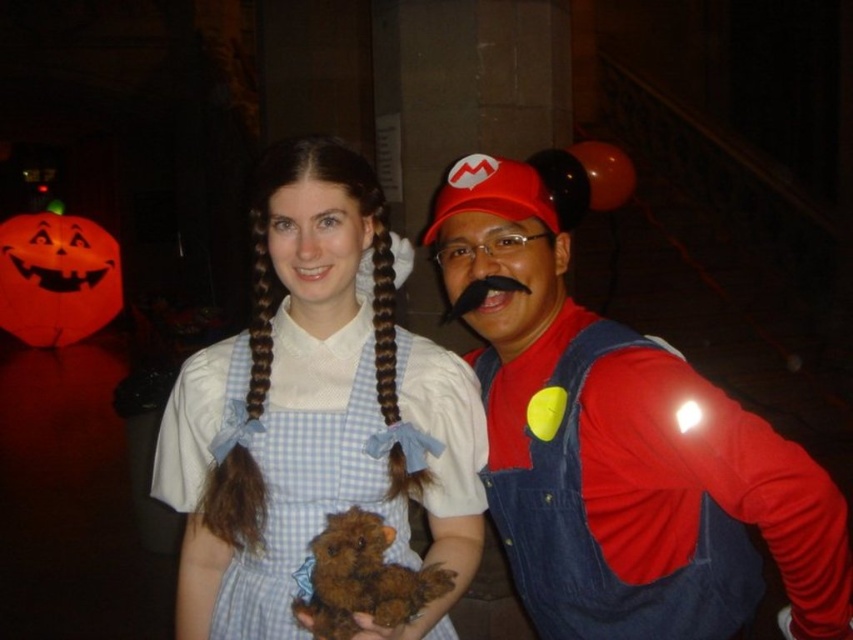
Does point (363, 346) come behind point (392, 380)?

That is True.

Find the location of a particular element. blue checkered dress at center is located at coordinates (315, 413).

In order to click on blue checkered dress at center in this screenshot , I will do `click(315, 413)`.

Is point (717, 445) closer to viewer compared to point (392, 372)?

Yes, point (717, 445) is closer to viewer.

Which is behind, point (643, 420) or point (250, 349)?

The point (250, 349) is more distant.

The width and height of the screenshot is (853, 640). Identify the location of red denim overalls at right. (621, 448).

Between red denim overalls at right and blue checkered dress at center, which one appears on the right side from the viewer's perspective?

red denim overalls at right

Is red denim overalls at right further to camera compared to blue checkered dress at center?

Yes, red denim overalls at right is behind blue checkered dress at center.

Between point (566, 369) and point (433, 500), which one is positioned in front?

Positioned in front is point (566, 369).

This screenshot has width=853, height=640. What are the coordinates of `red denim overalls at right` in the screenshot? It's located at (621, 448).